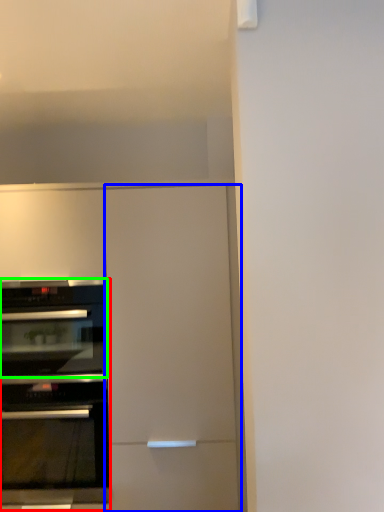
Question: Which object is positioned farthest from oven (highlighted by a red box)? Select from door (highlighted by a blue box) and oven (highlighted by a green box).

Choices:
 (A) door
 (B) oven

Answer: (A)